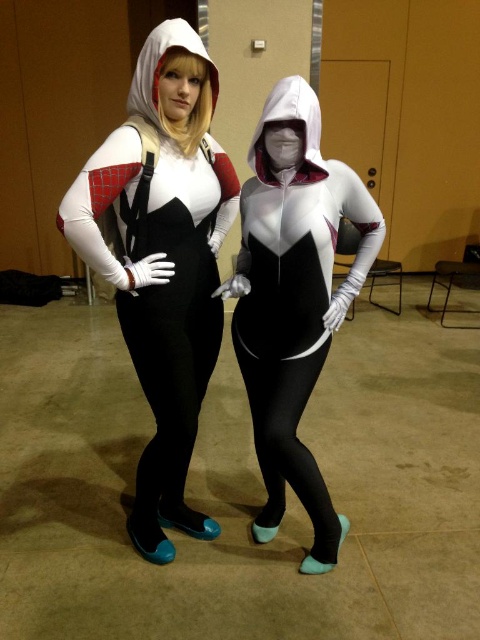
Looking at this image, you are a costume designer trying to arrange two Spider Man costumes for a photo shoot. The costumes are the matte white bodysuit at center and the white matte bodysuit at center. According to the image, which one is positioned higher?

The matte white bodysuit at center is located above the white matte bodysuit at center, so it is positioned higher.

You are organizing a costume party and need to arrange two Spider Man costumes for a photo. The costumes are the matte white bodysuit at center and the white matte bodysuit at center. According to the image, which costume is on the left side?

The matte white bodysuit at center is positioned on the left side of the white matte bodysuit at center.